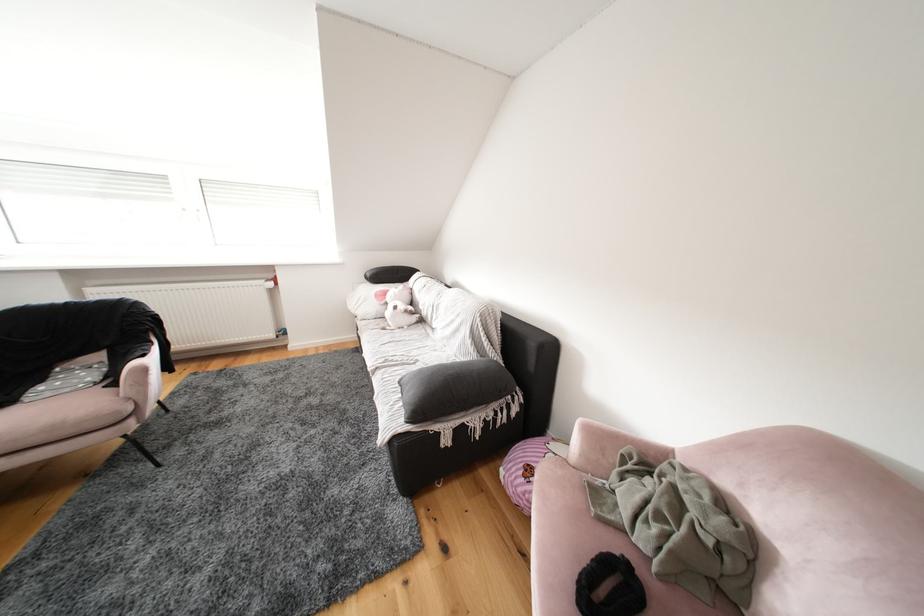
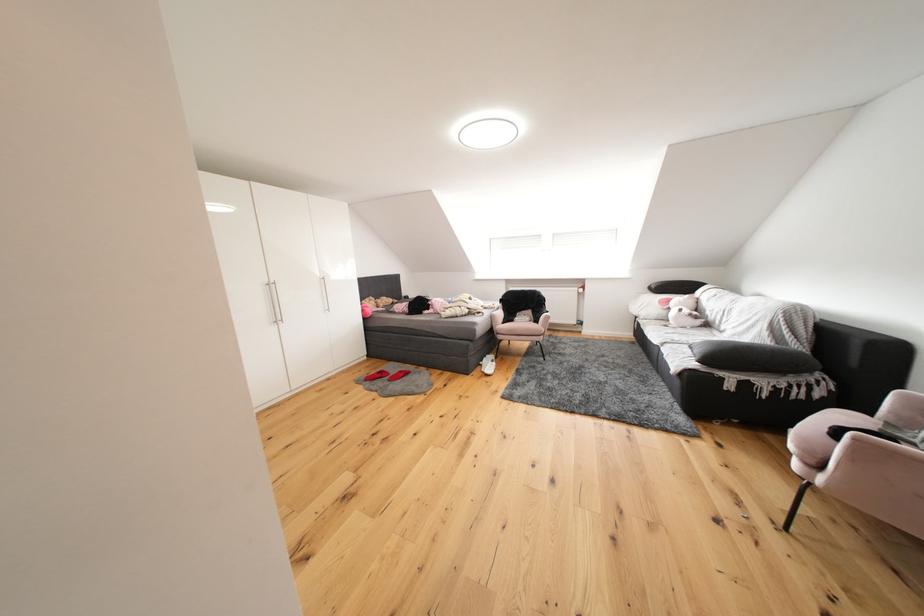
Where in the second image is the point corresponding to point (394, 297) from the first image?

(677, 305)